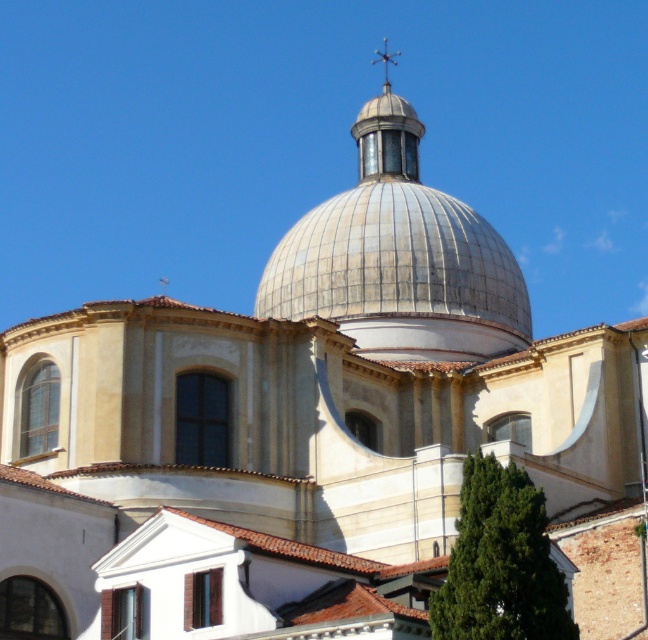
Question: Is metallic silver dome at center in front of metallic spire at center?

Choices:
 (A) yes
 (B) no

Answer: (A)

Question: Is the position of metallic silver dome at center less distant than that of metallic spire at center?

Choices:
 (A) yes
 (B) no

Answer: (A)

Question: Which object appears farthest from the camera in this image?

Choices:
 (A) metallic spire at center
 (B) metallic silver dome at center

Answer: (A)

Question: Which point is farther to the camera?

Choices:
 (A) pyautogui.click(x=435, y=317)
 (B) pyautogui.click(x=384, y=88)

Answer: (B)

Question: Is metallic silver dome at center smaller than metallic spire at center?

Choices:
 (A) no
 (B) yes

Answer: (A)